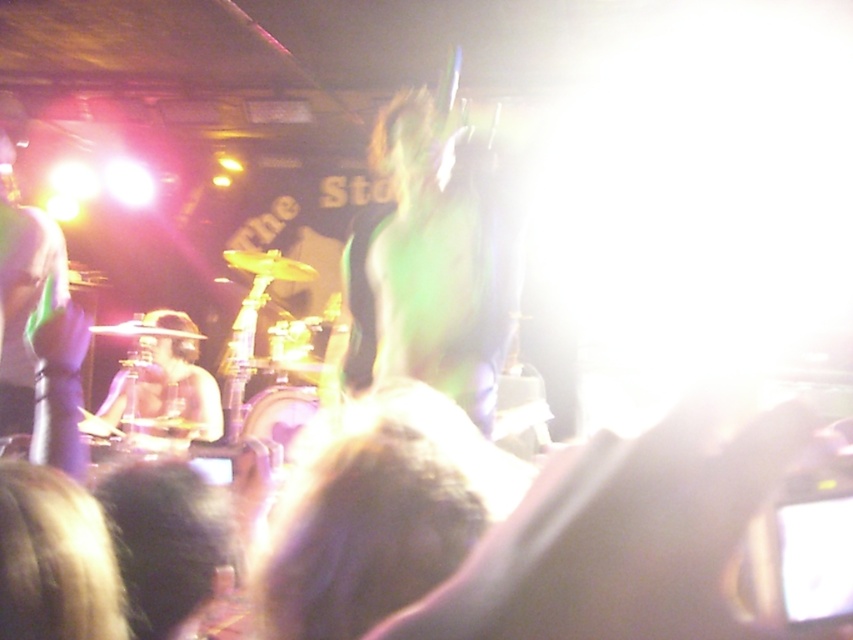
Question: Does green matte hand at center have a greater width compared to shiny purple shirt at left?

Choices:
 (A) yes
 (B) no

Answer: (B)

Question: Is green matte hand at center below shiny purple shirt at left?

Choices:
 (A) no
 (B) yes

Answer: (A)

Question: Can you confirm if green matte hand at center is positioned above shiny purple shirt at left?

Choices:
 (A) no
 (B) yes

Answer: (B)

Question: Which of the following is the closest to the observer?

Choices:
 (A) (376, 316)
 (B) (148, 346)

Answer: (A)